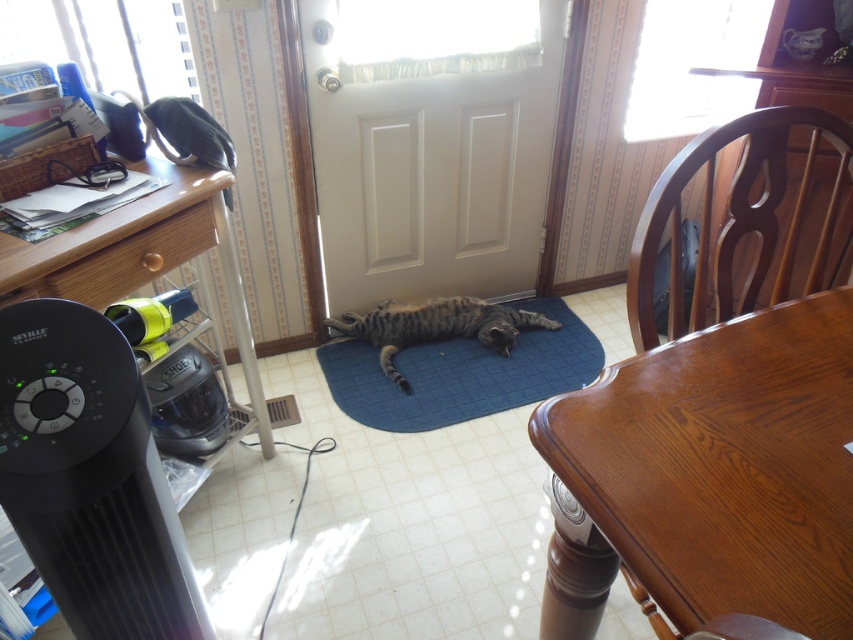
Question: Which point is closer to the camera?

Choices:
 (A) shiny brown wood table at lower right
 (B) tabby fur cat at center
 (C) brown wood chair at right

Answer: (A)

Question: Can you confirm if black plastic table at left is smaller than brown wood chair at right?

Choices:
 (A) no
 (B) yes

Answer: (A)

Question: Which of the following is the closest to the observer?

Choices:
 (A) tabby fur cat at center
 (B) shiny brown wood table at lower right
 (C) brown wood chair at right
 (D) black plastic table at left

Answer: (B)

Question: Which is nearer to the tabby fur cat at center?

Choices:
 (A) shiny brown wood table at lower right
 (B) black plastic table at left
 (C) brown wood chair at right

Answer: (B)

Question: Can you confirm if shiny brown wood table at lower right is positioned below brown wood chair at right?

Choices:
 (A) yes
 (B) no

Answer: (A)

Question: Does brown wood chair at right appear on the right side of tabby fur cat at center?

Choices:
 (A) yes
 (B) no

Answer: (A)